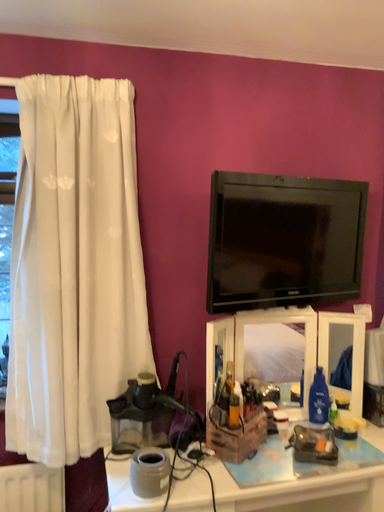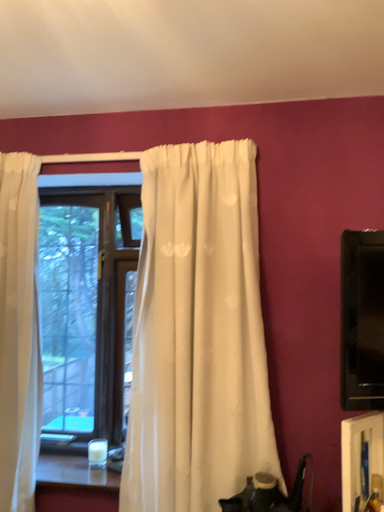
Question: How did the camera likely rotate when shooting the video?

Choices:
 (A) rotated upward
 (B) rotated downward

Answer: (A)